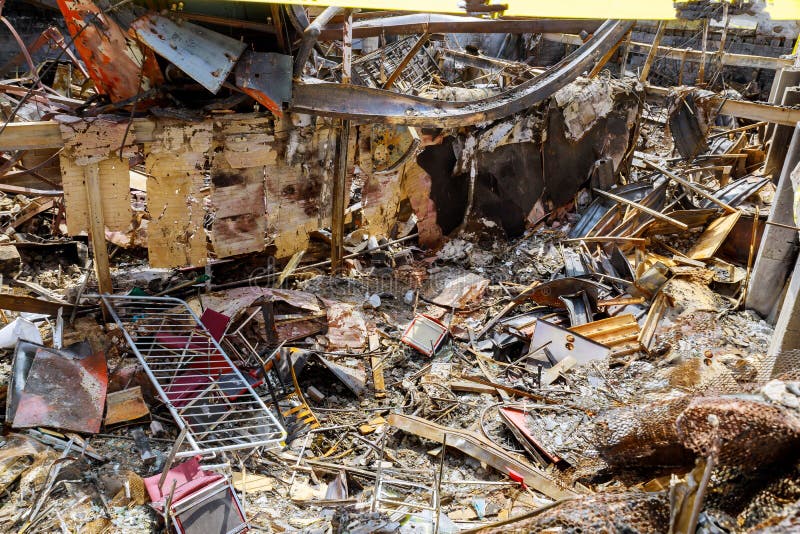
You are a GUI agent. You are given a task and a screenshot of the screen. Output one action in this format:
    pyautogui.click(x=<x>, y=<y>)
    Task: Click on the concrete pillars
    This screenshot has height=534, width=800.
    Given the screenshot: What is the action you would take?
    pyautogui.click(x=778, y=229), pyautogui.click(x=780, y=130), pyautogui.click(x=780, y=81), pyautogui.click(x=782, y=352)